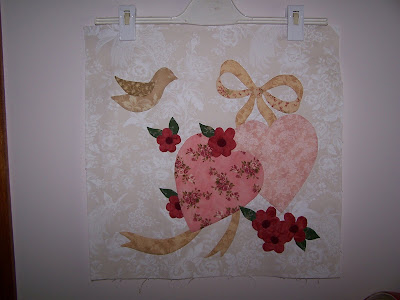
The height and width of the screenshot is (300, 400). Identify the location of quilted cloth. (202, 44).